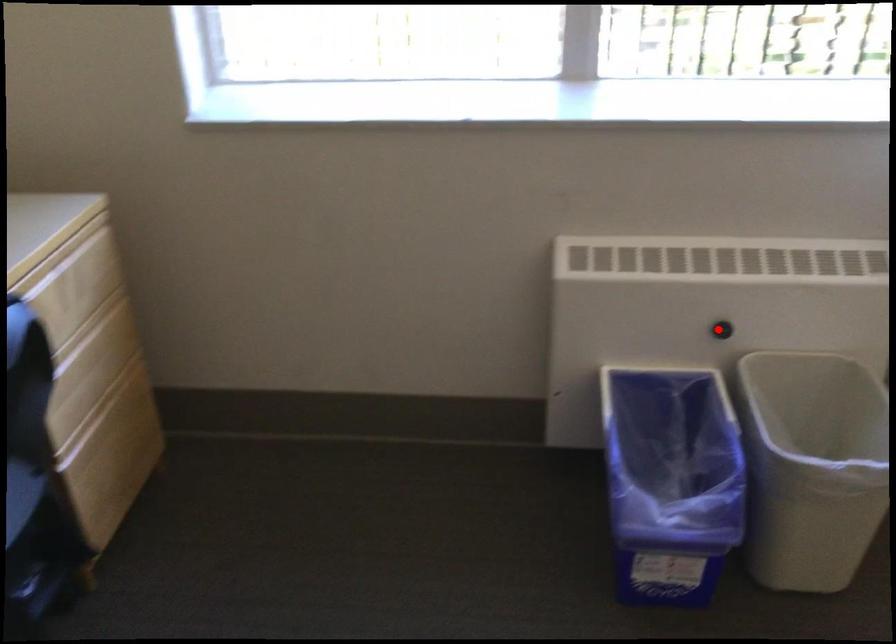
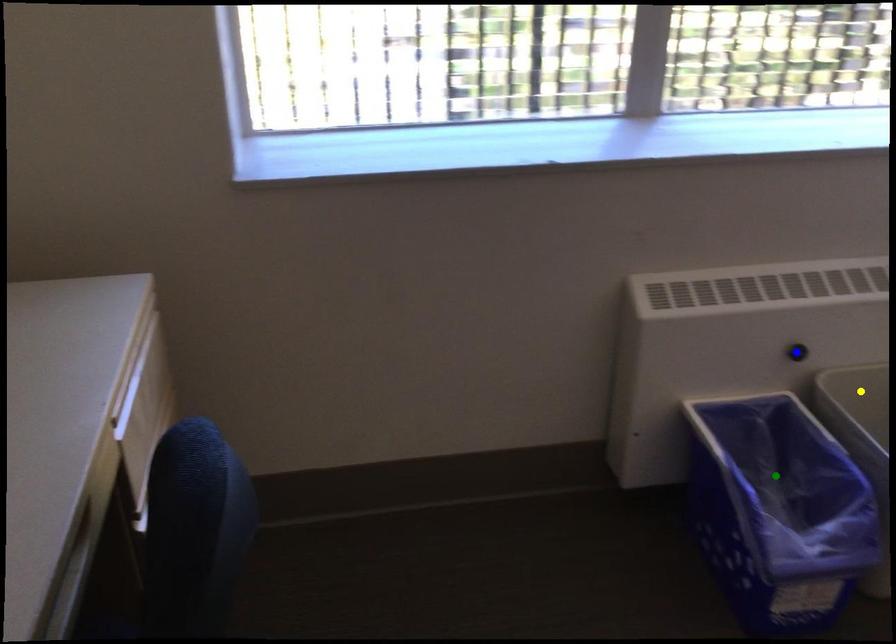
Question: I am providing you with two images of the same scene from different viewpoints. A red point is marked on the first image. You are given multiple points on the second image. Which mark in image 2 goes with the point in image 1?

Choices:
 (A) green point
 (B) yellow point
 (C) blue point

Answer: (C)